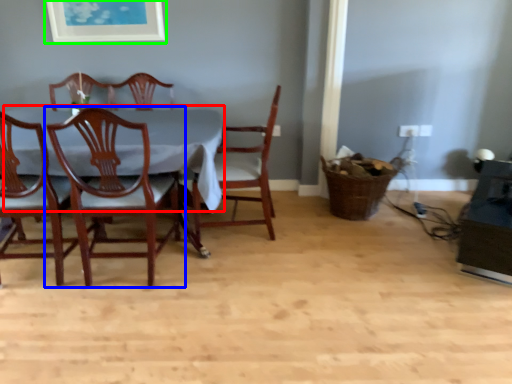
Question: Which is farther away from table top (highlighted by a red box)? chair (highlighted by a blue box) or picture frame (highlighted by a green box)?

Choices:
 (A) chair
 (B) picture frame

Answer: (B)